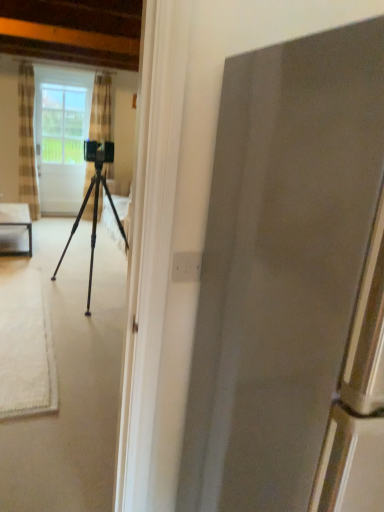
Question: Does point (4, 210) appear closer or farther from the camera than point (33, 89)?

Choices:
 (A) closer
 (B) farther

Answer: (A)

Question: Is clear glass table at left bigger or smaller than checkered fabric curtain at left, the 1th curtain positioned from the left?

Choices:
 (A) small
 (B) big

Answer: (B)

Question: Which is nearer to the striped fabric curtain at center, positioned as the second curtain in left-to-right order?

Choices:
 (A) metallic tripod at center
 (B) clear glass screen door at upper left
 (C) checkered fabric curtain at left, the second curtain from the right
 (D) clear glass table at left

Answer: (B)

Question: Estimate the real-world distances between objects in this image. Which object is closer to the clear glass table at left?

Choices:
 (A) metallic tripod at center
 (B) clear glass screen door at upper left
 (C) checkered fabric curtain at left, the 1th curtain positioned from the left
 (D) striped fabric curtain at center, positioned as the second curtain in left-to-right order

Answer: (A)